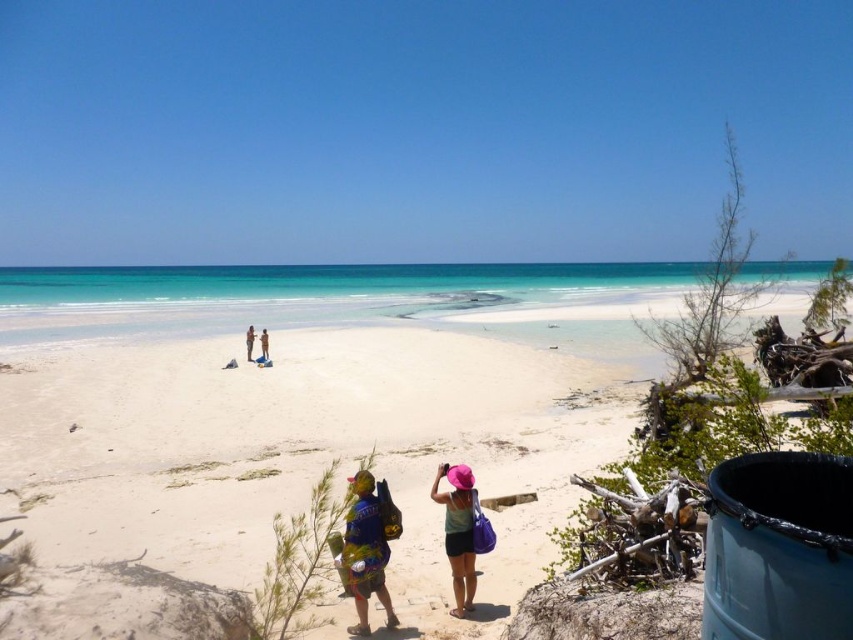
You are a photographer trying to capture the beach scene. You have a camera with a limited zoom lens that can only focus on objects within 3 meters. The multicolored fabric backpack at lower center is closer to you than the light blue fabric at center. Can you focus on both objects simultaneously?

The multicolored fabric backpack at lower center is smaller than the light blue fabric at center, so the backpack is closer. Since the backpack is within 3 meters, the light blue fabric at center might be further away. However, without knowing the exact distance between them, it is uncertain if both can be in focus at the same time.

You are standing at the camera position and want to walk directly to the white sand beach at center. Which direction should you move in?

Since the white sand beach at center is located at point (302, 445) in 2D coordinates, you should move forward and slightly to the right to reach it.

You are standing on the beach and see two points marked on the sand. The first point is located at coordinates point (370, 506), and the second point is at point (264, 356). Which point is closer to your current position?

Point (370, 506) is closer to the viewer than point (264, 356), so the first point is closer to your current position.